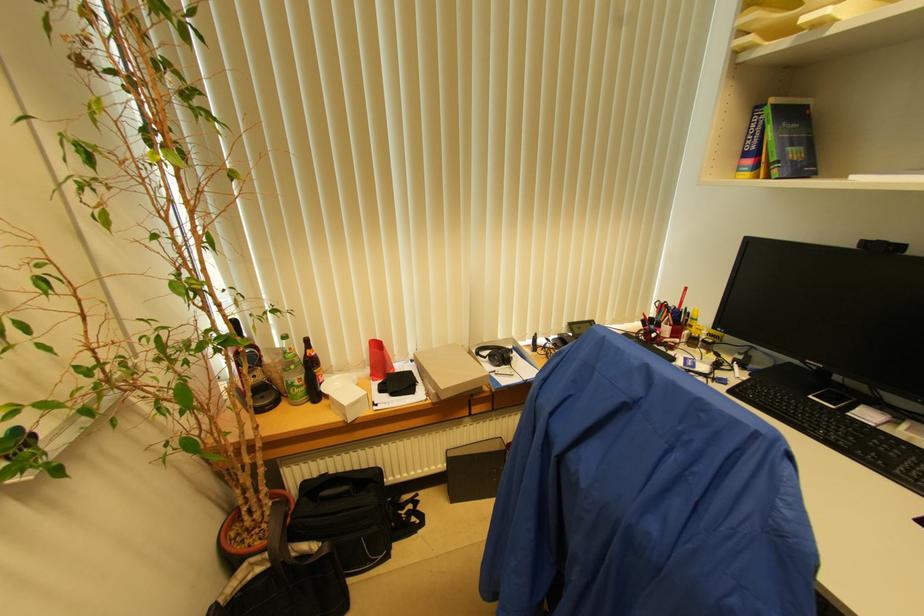
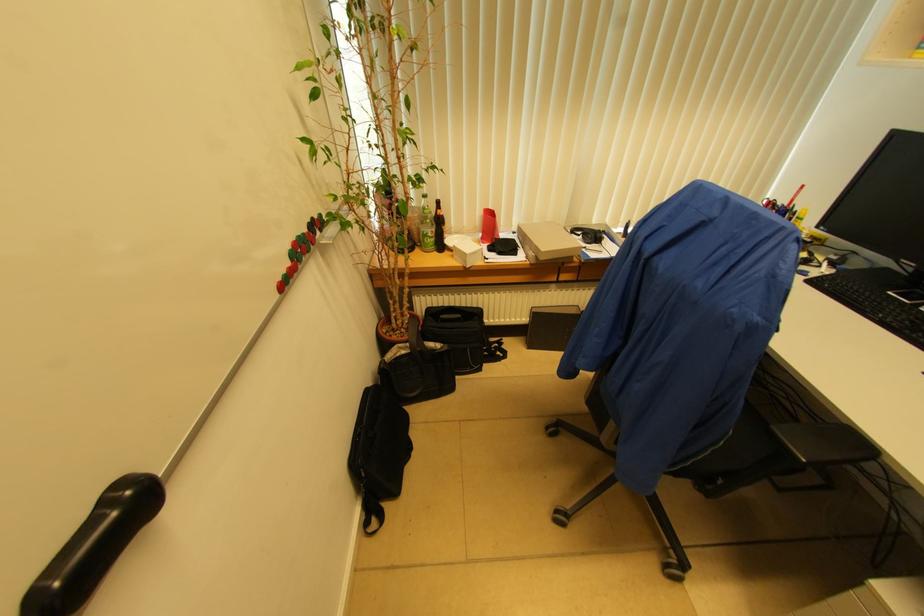
Where in the second image is the point corresponding to the point at 419,524 from the first image?

(503, 358)